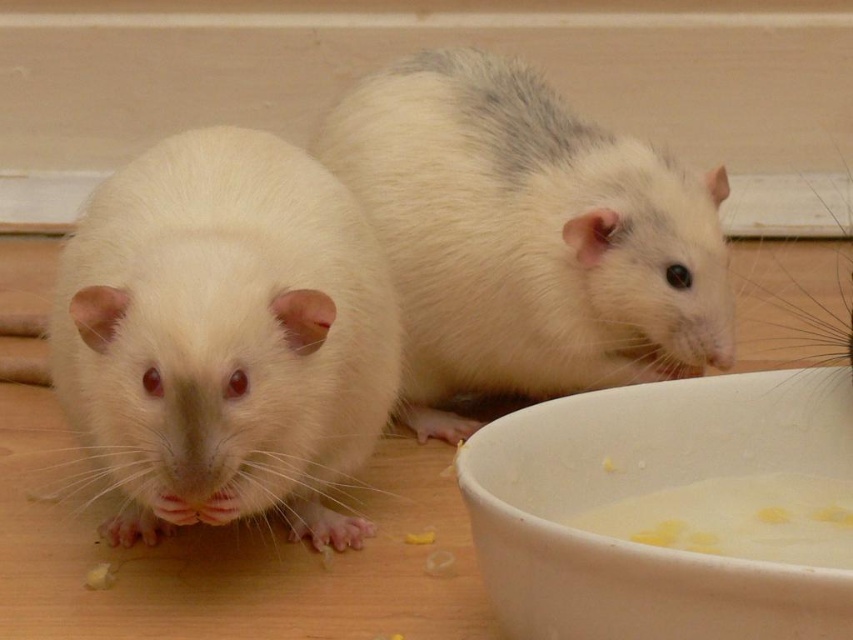
Question: Does white fur hamster at left have a smaller size compared to white fluffy hamster at upper right?

Choices:
 (A) yes
 (B) no

Answer: (A)

Question: Which object is the closest to the white fur hamster at left?

Choices:
 (A) white fluffy hamster at upper right
 (B) white creamy food at lower center

Answer: (A)

Question: Can you confirm if white fur hamster at left is positioned to the left of white matte bowl at lower right?

Choices:
 (A) yes
 (B) no

Answer: (A)

Question: Which of the following is the farthest from the observer?

Choices:
 (A) white creamy food at lower center
 (B) white fluffy hamster at upper right
 (C) white fur hamster at left

Answer: (B)

Question: Is white fur hamster at left above white fluffy hamster at upper right?

Choices:
 (A) yes
 (B) no

Answer: (B)

Question: Among these points, which one is farthest from the camera?

Choices:
 (A) (459, 340)
 (B) (389, 339)
 (C) (567, 612)
 (D) (618, 508)

Answer: (A)